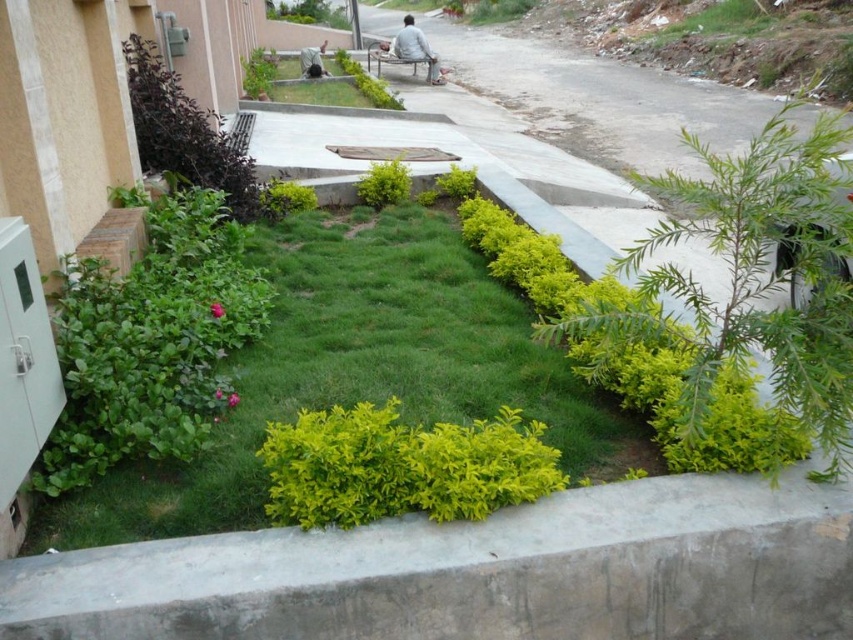
You are standing at the entrance of the garden and want to sit down on the light gray fabric bench at center. Which direction should you walk to reach it?

The light gray fabric bench at center is located at point (416, 49), so you should walk towards the center of the garden to reach it.

You are designing a garden layout and need to place both the light gray fabric bench at center and the wooden bench at center along the same pathway. Given their widths, which bench should be placed first if you want to prioritize the wider one for better visibility?

The light gray fabric bench at center should be placed first because its width surpasses the wooden bench at center, making it wider and thus better for visibility.

You are a gardener who needs to choose between two benches in the garden. The light gray fabric bench at center and the wooden bench at center. Which one is taller?

The light gray fabric bench at center is taller than the wooden bench at center.